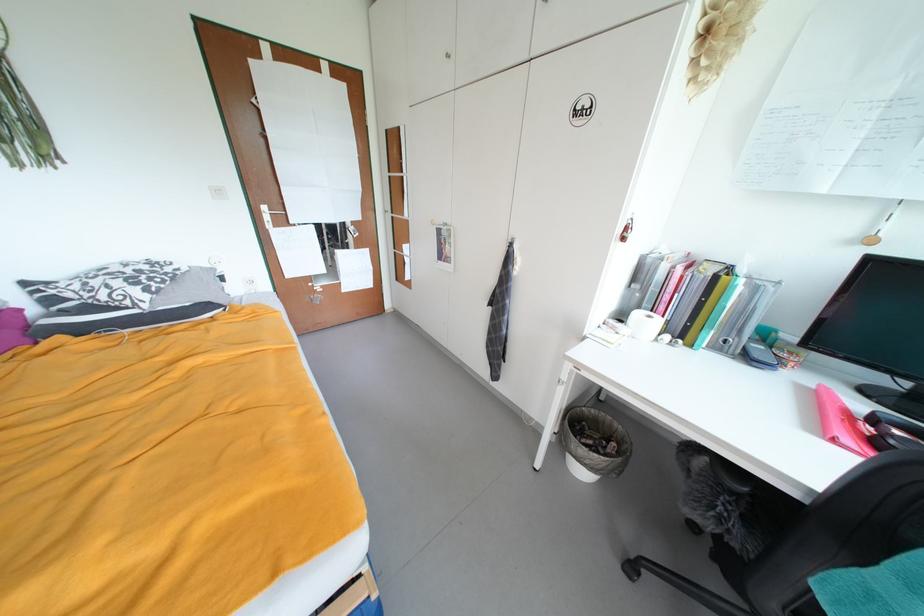
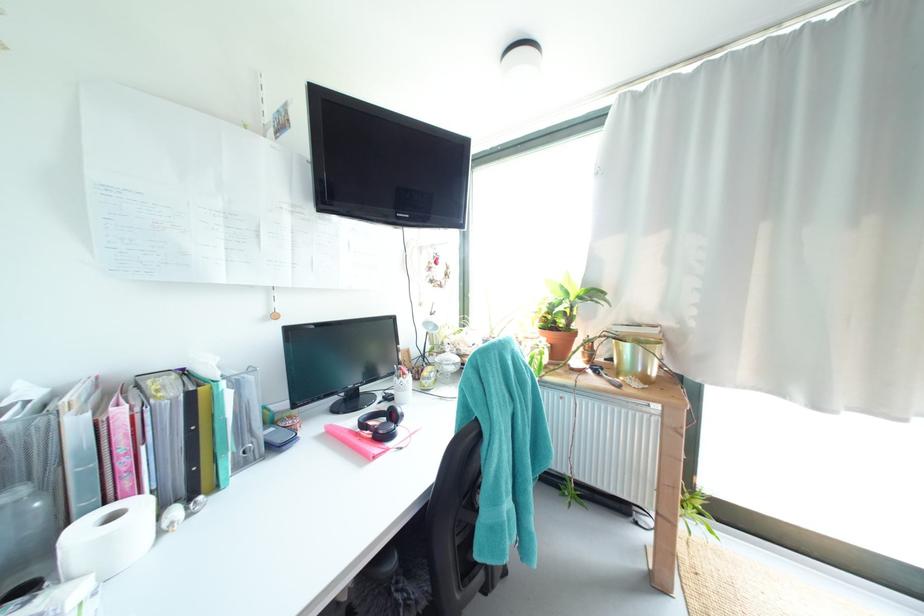
Where in the second image is the point corresponding to point (657, 318) from the first image?

(120, 517)